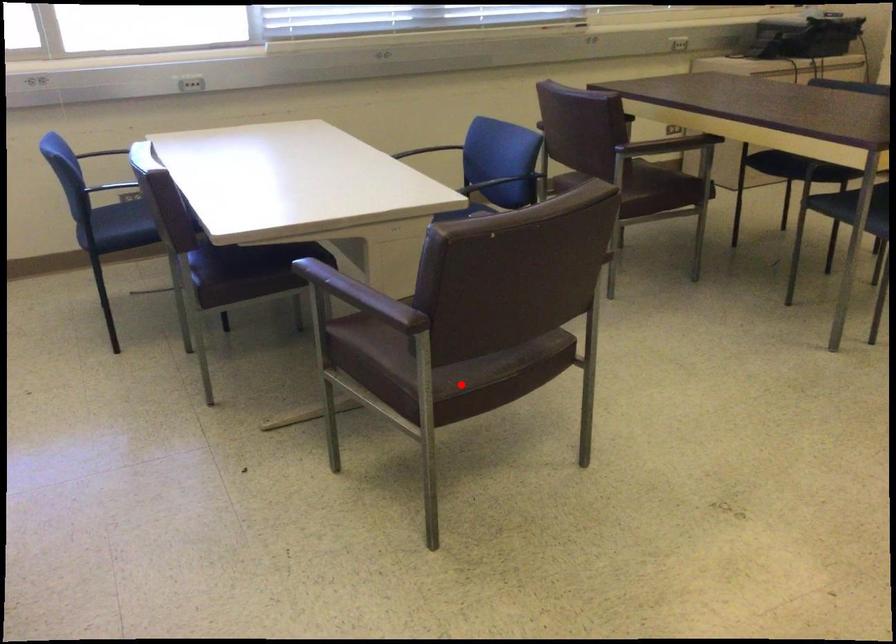
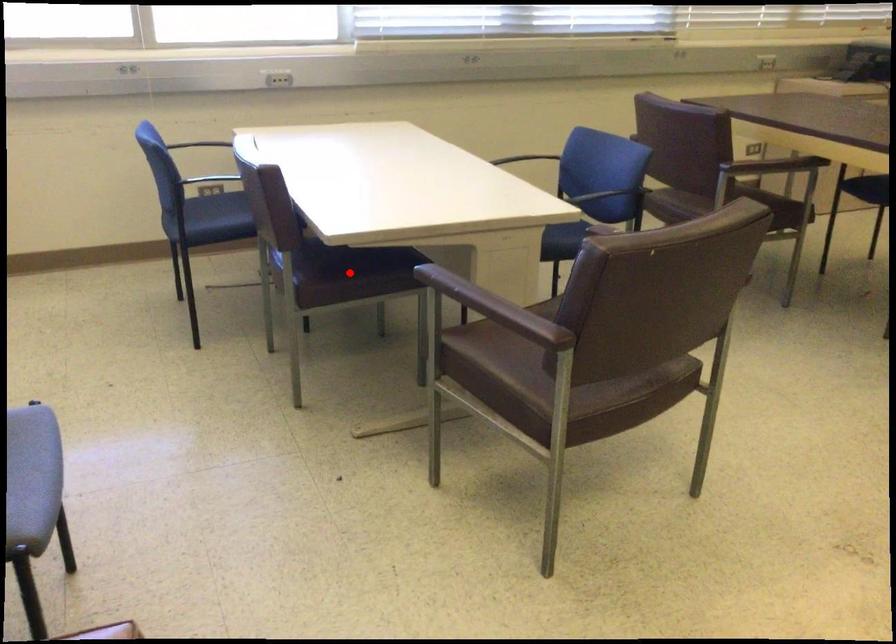
I am providing you with two images of the same scene from different viewpoints. A red point is marked on the first image and another point is marked on the second image. Is the marked point in image1 the same physical position as the marked point in image2?

No